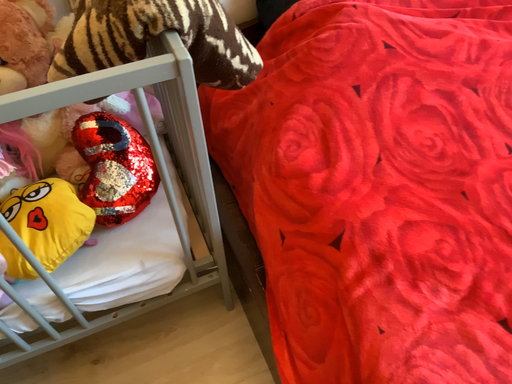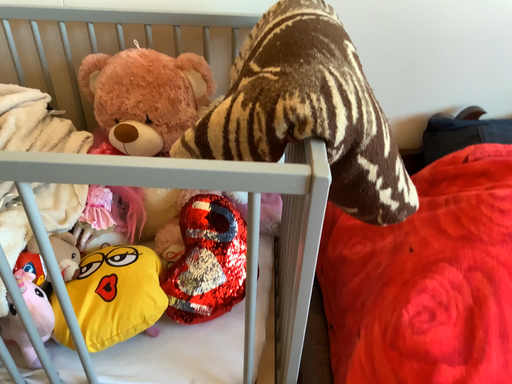
Question: How did the camera likely rotate when shooting the video?

Choices:
 (A) rotated right
 (B) rotated left

Answer: (B)